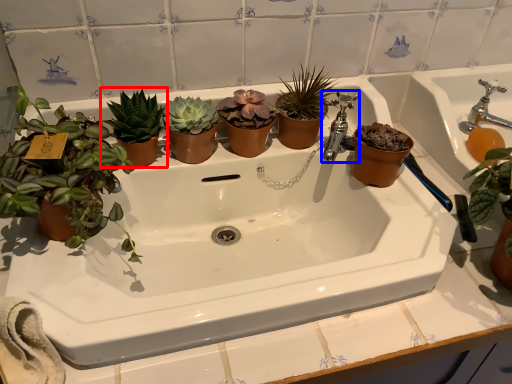
Question: Which of the following is the closest to the observer, houseplant (highlighted by a red box) or tap (highlighted by a blue box)?

Choices:
 (A) houseplant
 (B) tap

Answer: (A)